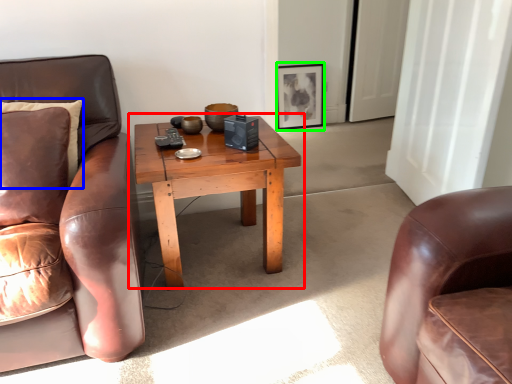
Question: Which object is positioned closest to coffee table (highlighted by a red box)? Select from pillow (highlighted by a blue box) and picture frame (highlighted by a green box).

Choices:
 (A) pillow
 (B) picture frame

Answer: (A)